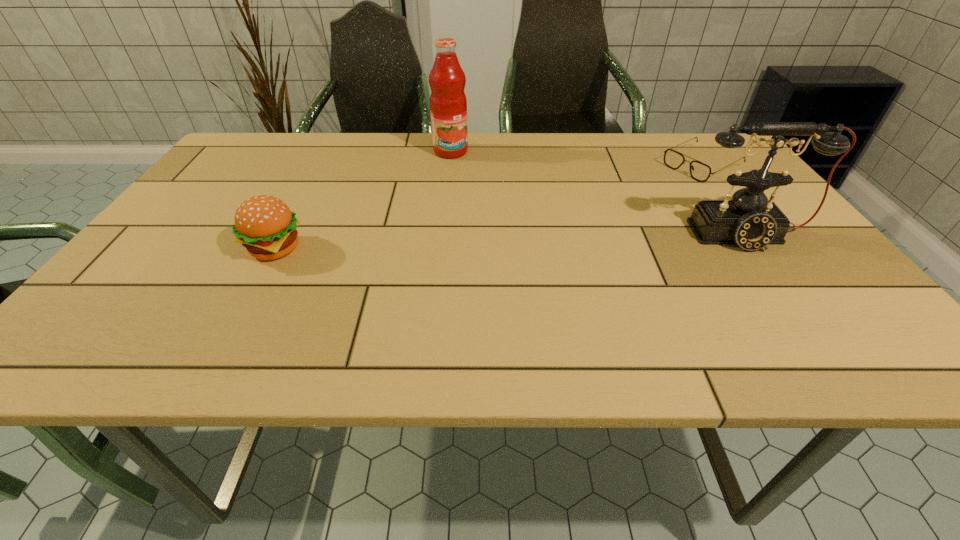
This screenshot has height=540, width=960. I want to click on free location at the right edge, so click(x=835, y=285).

In the image, there is a desktop. At what (x,y) coordinates should I click in order to perform the action: click on free space at the far right corner. Please return your answer as a coordinate pair (x, y). The height and width of the screenshot is (540, 960). Looking at the image, I should click on (705, 134).

Identify the location of free space between the sunglasses and the third tallest object. The width and height of the screenshot is (960, 540). tap(489, 207).

I want to click on free point between the third shortest object and the fruit juice, so click(598, 193).

Where is `free space between the fruit juice and the telephone`? The height and width of the screenshot is (540, 960). free space between the fruit juice and the telephone is located at coordinates (598, 193).

Locate an element on the screen. Image resolution: width=960 pixels, height=540 pixels. free space between the third shortest object and the leftmost object is located at coordinates (512, 242).

The height and width of the screenshot is (540, 960). I want to click on vacant area that lies between the sunglasses and the third tallest object, so click(489, 207).

Identify the location of vacant space in between the second object from left to right and the leftmost object. (364, 200).

The height and width of the screenshot is (540, 960). Find the location of `free space that is in between the fruit juice and the telephone`. free space that is in between the fruit juice and the telephone is located at coordinates (598, 193).

Where is `vacant space in between the telephone and the fruit juice`? Image resolution: width=960 pixels, height=540 pixels. vacant space in between the telephone and the fruit juice is located at coordinates (598, 193).